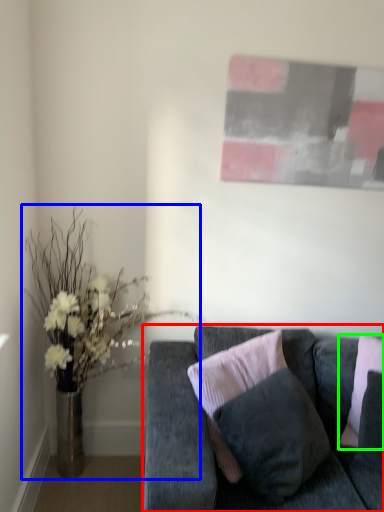
Question: Which object is positioned closest to studio couch (highlighted by a red box)? Select from houseplant (highlighted by a blue box) and pillow (highlighted by a green box).

Choices:
 (A) houseplant
 (B) pillow

Answer: (B)